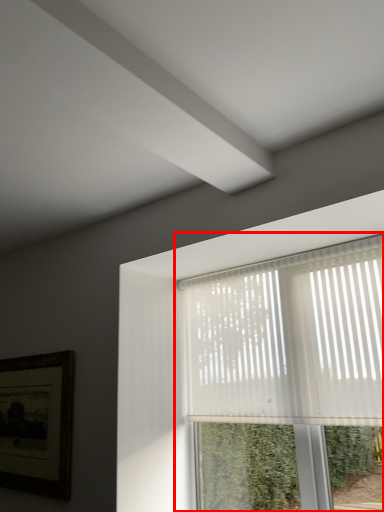
Question: From the image's perspective, what is the correct spatial positioning of window (annotated by the red box) in reference to picture frame?

Choices:
 (A) below
 (B) above

Answer: (B)